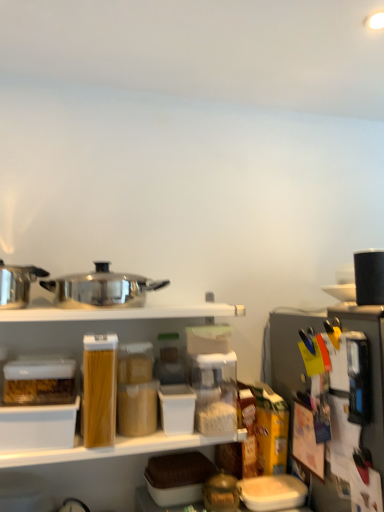
Question: Is polished stainless steel pot at left, marked as the 4th appliance in a right-to-left arrangement, facing away from black matte coffee maker at upper right, acting as the first appliance starting from the right?

Choices:
 (A) no
 (B) yes

Answer: (A)

Question: Considering the relative positions of polished stainless steel pot at left, which ranks as the first appliance in left-to-right order, and black matte coffee maker at upper right, acting as the first appliance starting from the right, in the image provided, is polished stainless steel pot at left, which ranks as the first appliance in left-to-right order, to the right of black matte coffee maker at upper right, acting as the first appliance starting from the right, from the viewer's perspective?

Choices:
 (A) yes
 (B) no

Answer: (B)

Question: Can you confirm if polished stainless steel pot at left, marked as the 4th appliance in a right-to-left arrangement, is bigger than black matte coffee maker at upper right, positioned as the fourth appliance in left-to-right order?

Choices:
 (A) no
 (B) yes

Answer: (B)

Question: Does polished stainless steel pot at left, marked as the 4th appliance in a right-to-left arrangement, come behind black matte coffee maker at upper right, acting as the first appliance starting from the right?

Choices:
 (A) no
 (B) yes

Answer: (A)

Question: Would you say polished stainless steel pot at left, marked as the 4th appliance in a right-to-left arrangement, is outside black matte coffee maker at upper right, positioned as the fourth appliance in left-to-right order?

Choices:
 (A) no
 (B) yes

Answer: (B)

Question: Is polished stainless steel pot at left, marked as the 4th appliance in a right-to-left arrangement, to the left of black matte coffee maker at upper right, positioned as the fourth appliance in left-to-right order, from the viewer's perspective?

Choices:
 (A) no
 (B) yes

Answer: (B)

Question: Does white plastic shelf at upper center have a lesser width compared to brown woven basket at center?

Choices:
 (A) yes
 (B) no

Answer: (B)

Question: Can you confirm if white plastic shelf at upper center is wider than brown woven basket at center?

Choices:
 (A) yes
 (B) no

Answer: (A)

Question: Is white plastic shelf at upper center behind brown woven basket at center?

Choices:
 (A) yes
 (B) no

Answer: (B)

Question: Is brown woven basket at center completely or partially inside white plastic shelf at upper center?

Choices:
 (A) yes
 (B) no

Answer: (B)

Question: Does white plastic shelf at upper center have a greater height compared to brown woven basket at center?

Choices:
 (A) yes
 (B) no

Answer: (B)

Question: Can you confirm if white plastic shelf at upper center is bigger than brown woven basket at center?

Choices:
 (A) no
 (B) yes

Answer: (B)

Question: Are black matte coffee maker at upper right, positioned as the fourth appliance in left-to-right order, and metallic silver coffee maker at right, the second appliance positioned from the right, located far from each other?

Choices:
 (A) yes
 (B) no

Answer: (B)